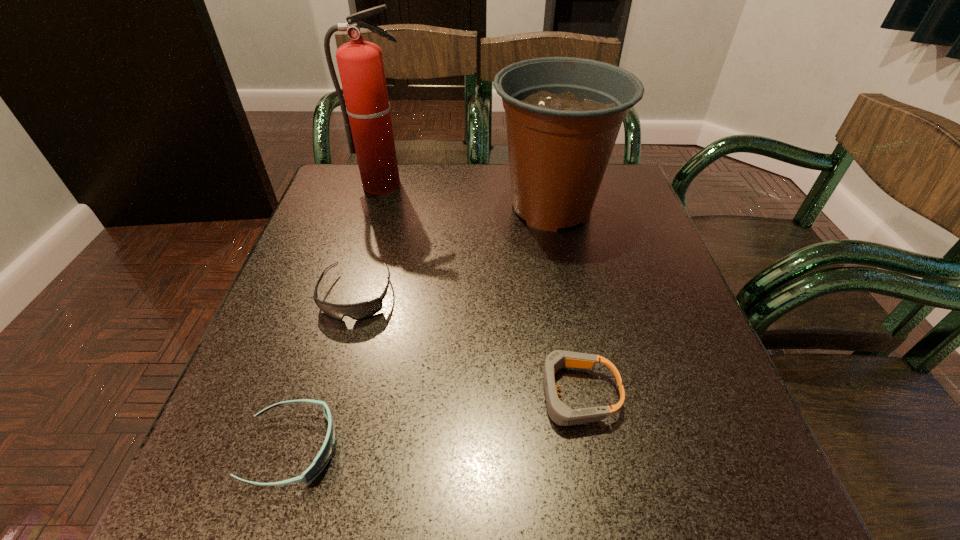
Select which object appears as the fourth closest to the farthest goggles. Please provide its 2D coordinates. Your answer should be formatted as a tuple, i.e. [(x, y)], where the tuple contains the x and y coordinates of a point satisfying the conditions above.

[(367, 119)]

Locate which goggles is the closest to the farthest goggles. Please provide its 2D coordinates. Your answer should be formatted as a tuple, i.e. [(x, y)], where the tuple contains the x and y coordinates of a point satisfying the conditions above.

[(321, 460)]

Find the location of a particular element. The height and width of the screenshot is (540, 960). goggles identified as the second closest to the tallest object is located at coordinates (560, 413).

At what (x,y) coordinates should I click in order to perform the action: click on free space in the image that satisfies the following two spatial constraints: 1. with the nozzle and gauge on the second tallest object; 2. on the right side of the fire extinguisher. Please return your answer as a coordinate pair (x, y). Looking at the image, I should click on click(377, 207).

Find the location of `free location that satisfies the following two spatial constraints: 1. with the nozzle and gauge on the second tallest object; 2. on the left side of the fire extinguisher`. free location that satisfies the following two spatial constraints: 1. with the nozzle and gauge on the second tallest object; 2. on the left side of the fire extinguisher is located at coordinates (377, 207).

What are the coordinates of `free spot that satisfies the following two spatial constraints: 1. on the front side of the fourth shortest object; 2. on the front and back of the rightmost goggles` in the screenshot? It's located at (588, 394).

Find the location of a particular element. The height and width of the screenshot is (540, 960). vacant area that satisfies the following two spatial constraints: 1. with the nozzle and gauge on the flowerpot; 2. on the left side of the tallest object is located at coordinates (377, 207).